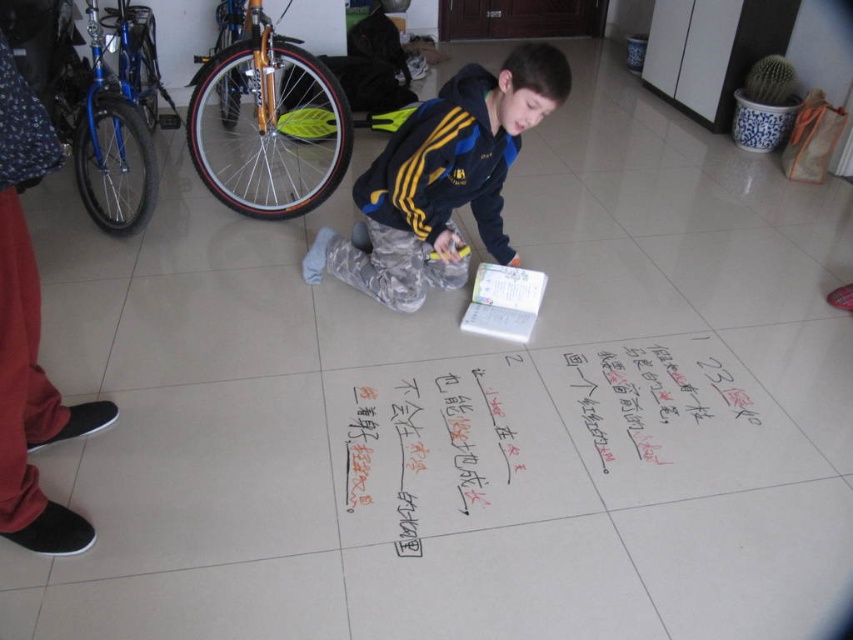
You are a parent observing your child in the room. You need to place a small stool between the dark blue fleece jacket at center and the gold metallic bicycle wheel at left. Which object should the stool be closer to to ensure it fits within the space?

The stool should be placed closer to the dark blue fleece jacket at center because it has a smaller width than the gold metallic bicycle wheel at left, allowing more space on the wider side for the stool.

You are a parent looking for your child who is wearing a dark blue fleece jacket at center. You see a blue metallic bicycle at upper left in the room. Which direction should you look relative to the bicycle to find the jacket?

The dark blue fleece jacket at center is to the right of the blue metallic bicycle at upper left, so you should look to the right of the bicycle to find the jacket.

The boy is using a yellow marker to write on the floor. He wants to place a new handwritten paper at center so it can be seen clearly. Considering the dark blue fleece jacket at center is currently in the way, where should he move the jacket?

The handwritten paper at center is in front of the dark blue fleece jacket at center, so the boy should move the dark blue fleece jacket at center backward to make space for the handwritten paper at center to be visible.